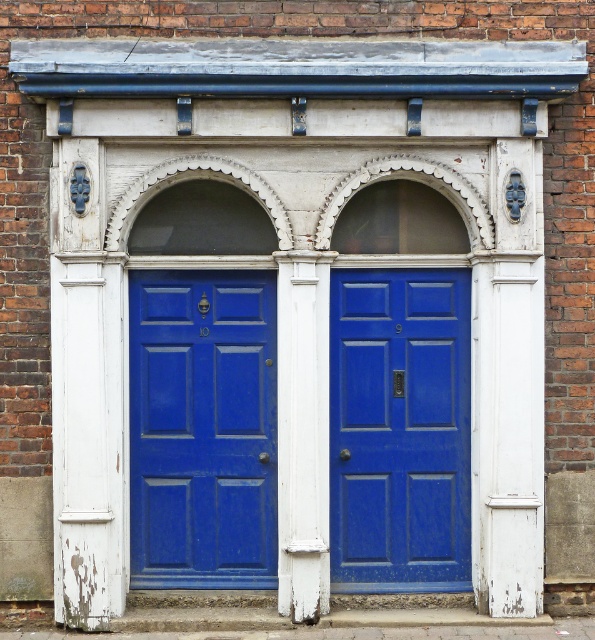
Between matte blue door at left and matte blue door at center, which one is positioned lower?

matte blue door at center

The width and height of the screenshot is (595, 640). I want to click on matte blue door at left, so click(x=202, y=428).

Is matte blue door at left positioned at the back of white painted wood pillar at center?

Yes, matte blue door at left is behind white painted wood pillar at center.

Image resolution: width=595 pixels, height=640 pixels. What are the coordinates of `matte blue door at left` in the screenshot? It's located at (202, 428).

Find the location of a particular element. matte blue door at center is located at coordinates (399, 429).

This screenshot has height=640, width=595. What do you see at coordinates (399, 429) in the screenshot?
I see `matte blue door at center` at bounding box center [399, 429].

The width and height of the screenshot is (595, 640). In order to click on matte blue door at center in this screenshot , I will do `click(399, 429)`.